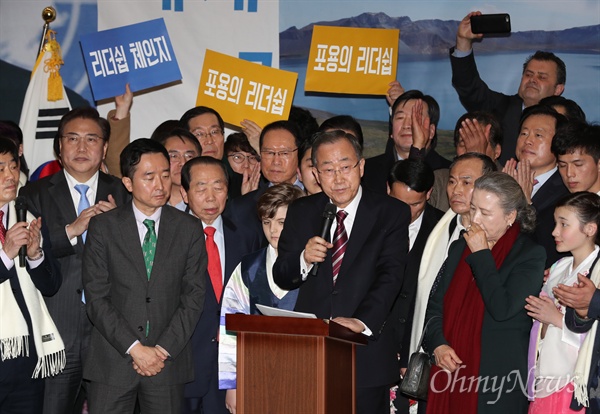
Locate an element on the screen. wall is located at coordinates pos(425,47).